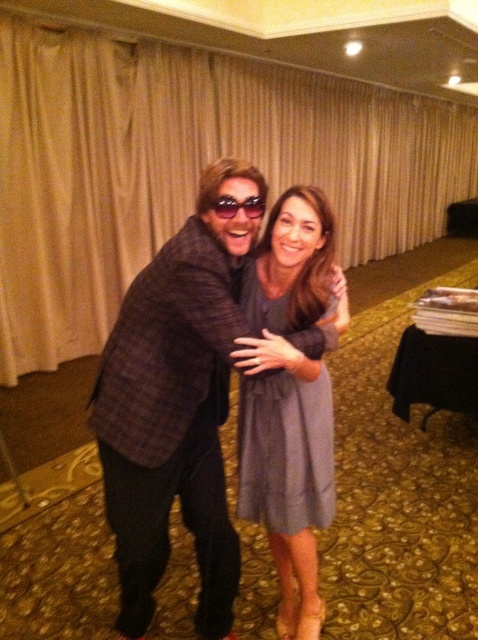
You are a photographer at a social event. You want to take a photo of the plaid fabric jacket at center and the gray satin dress at center. The minimum distance required for your camera to focus on both subjects clearly is 8 inches. Can you capture both items in focus without moving the camera or subjects?

The plaid fabric jacket at center is 7.60 inches away from the gray satin dress at center. Since the distance between them is less than the camera requirement of 8 inches, you can capture both items in focus without moving the camera or subjects.

You are standing in a room where two people are present. You notice the beige fabric curtain at upper center marked by point [185,168]. If you want to move towards the curtain, which direction should you walk relative to the man wearing a dark blazer and the woman in the gray dress?

The beige fabric curtain at upper center is located at point [185,168]. Since the man is on the left and the woman is on the right, the curtain is positioned above and between them. To reach the curtain, you should walk towards the center of the room, between the man and the woman.

You are at a social event and want to take a photo of both the plaid fabric jacket at center and the gray satin dress at center. Which one should you focus on first to ensure both are in focus?

You should focus on the plaid fabric jacket at center first since it is closer to the viewer than the gray satin dress at center, ensuring both will be in focus when using a camera with depth of field considerations.